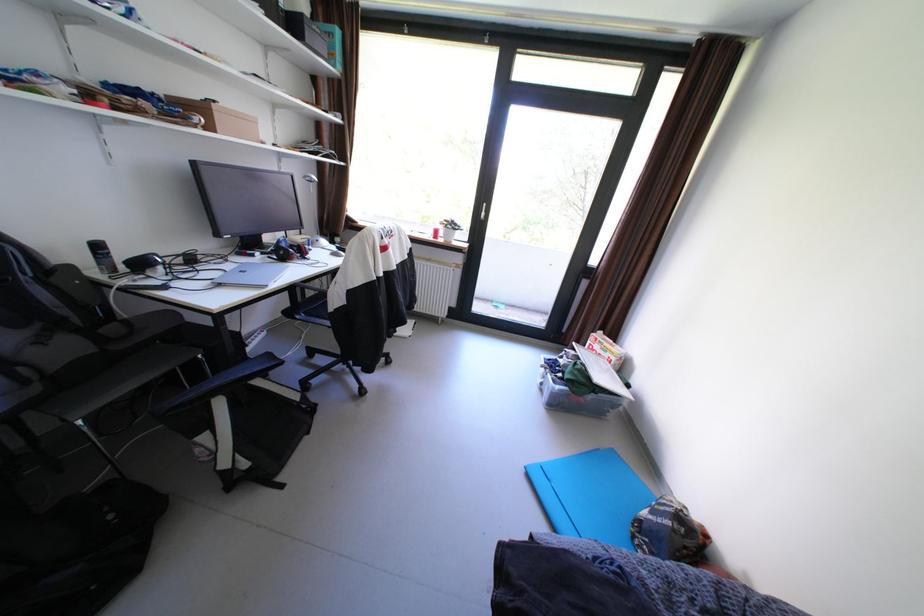
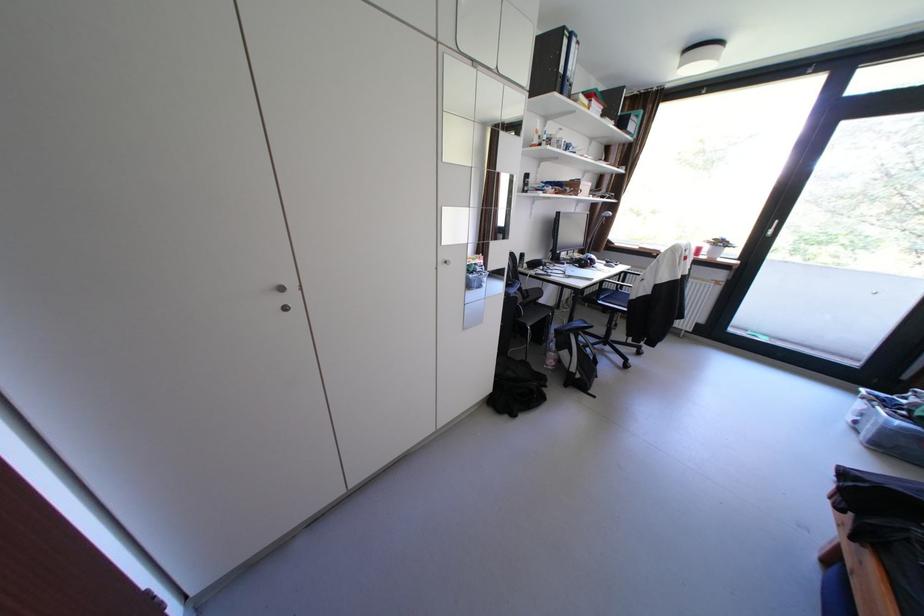
The point at (216, 434) is marked in the first image. Where is the corresponding point in the second image?

(578, 351)